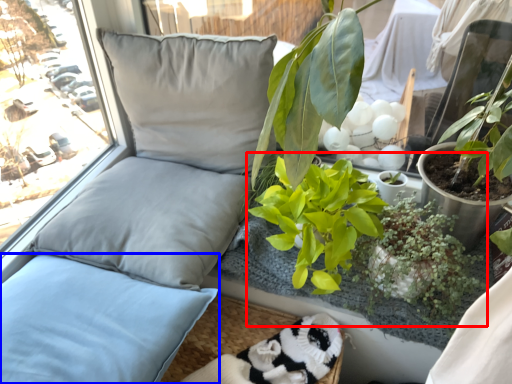
Question: Which object is further to the camera taking this photo, floral arrangement (highlighted by a red box) or pillow (highlighted by a blue box)?

Choices:
 (A) floral arrangement
 (B) pillow

Answer: (A)